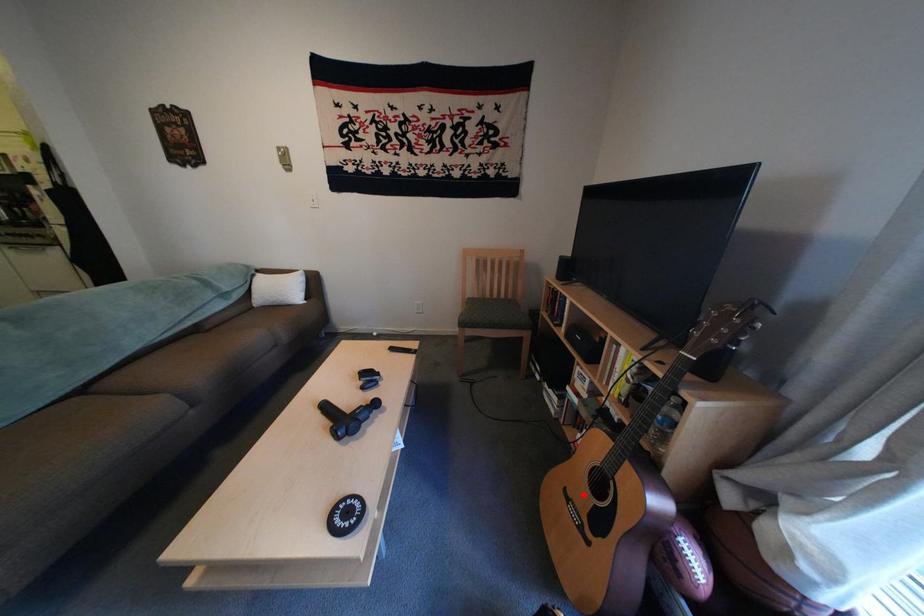
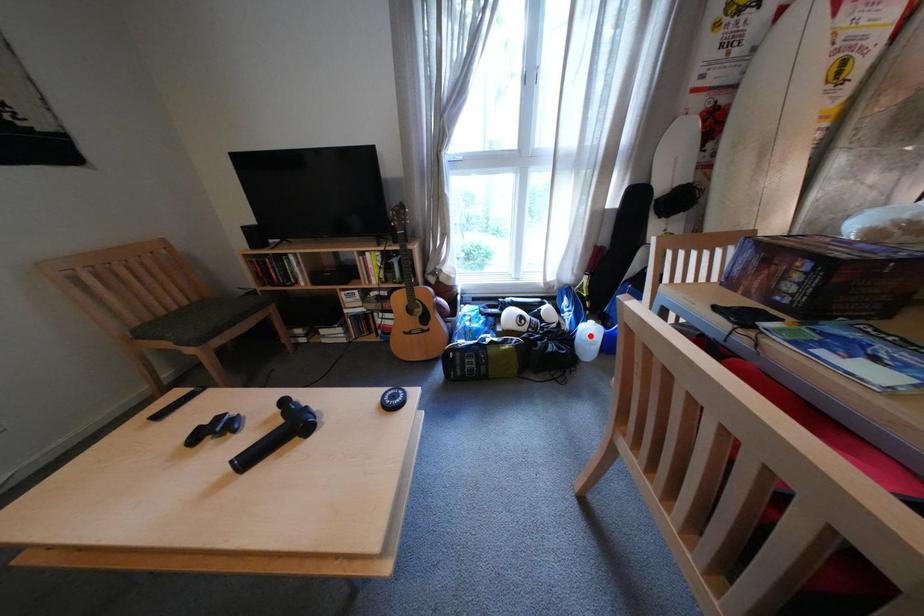
I am providing you with two images of the same scene from different viewpoints. A red point is marked on the first image and another point is marked on the second image. Does the point marked in image1 correspond to the same location as the one in image2?

No